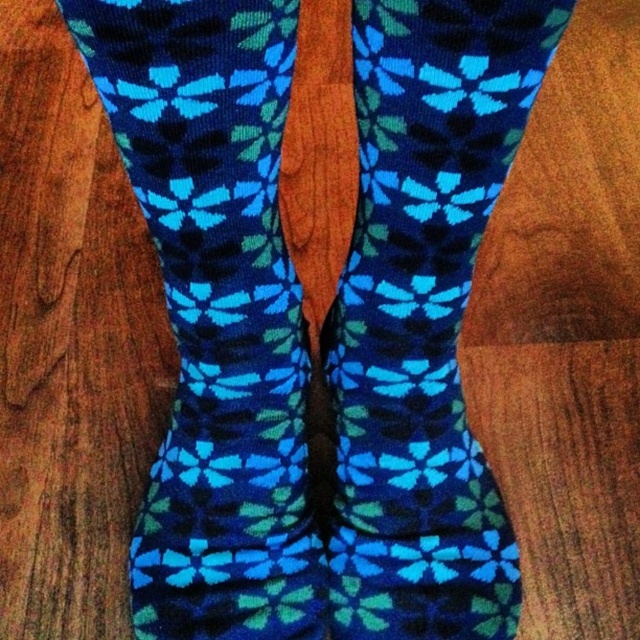
You are standing in front of a wooden table. You see a point at coordinates (x=216, y=314). What object is located at that point?

The point at coordinates (x=216, y=314) has blue knitted socks at center placed there.

You are examining the socks from above and notice two points marked on them. Which point is closer to you, point [237,573] or point [468,576]?

Point [237,573] is closer to the viewer than point [468,576].

You are organizing a drawer and see the blue knitted socks at center and the knitted blue socks at center. Which one is placed on top?

The blue knitted socks at center is positioned over knitted blue socks at center, so it is on top.